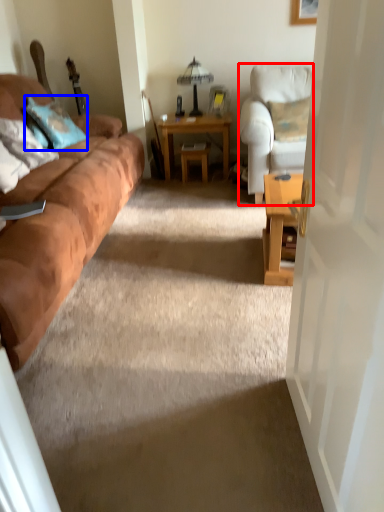
Question: Which object appears closest to the camera in this image, chair (highlighted by a red box) or pillow (highlighted by a blue box)?

Choices:
 (A) chair
 (B) pillow

Answer: (A)